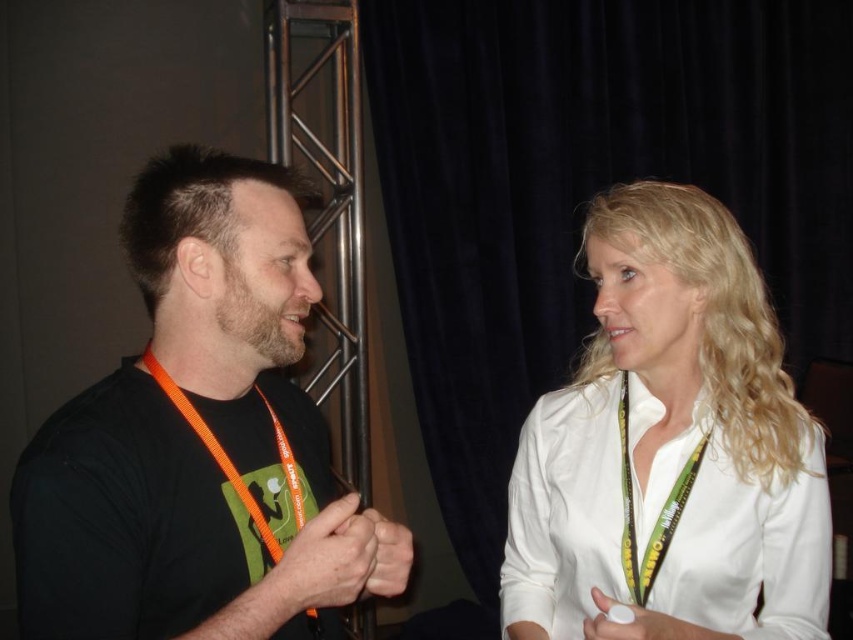
Question: Is black matte t-shirt at left to the left of green fabric lanyard at center from the viewer's perspective?

Choices:
 (A) yes
 (B) no

Answer: (A)

Question: Does black matte t-shirt at left lie in front of white smooth shirt at upper right?

Choices:
 (A) no
 (B) yes

Answer: (B)

Question: Can you confirm if green fabric lanyard at center is positioned below orange nylon lanyard at left?

Choices:
 (A) no
 (B) yes

Answer: (B)

Question: Estimate the real-world distances between objects in this image. Which object is closer to the green fabric lanyard at center?

Choices:
 (A) black matte t-shirt at left
 (B) white smooth shirt at upper right

Answer: (B)

Question: Which point appears farthest from the camera in this image?

Choices:
 (A) (659, 336)
 (B) (207, 442)

Answer: (A)

Question: Which of the following is the farthest from the observer?

Choices:
 (A) black matte t-shirt at left
 (B) green fabric lanyard at center

Answer: (B)